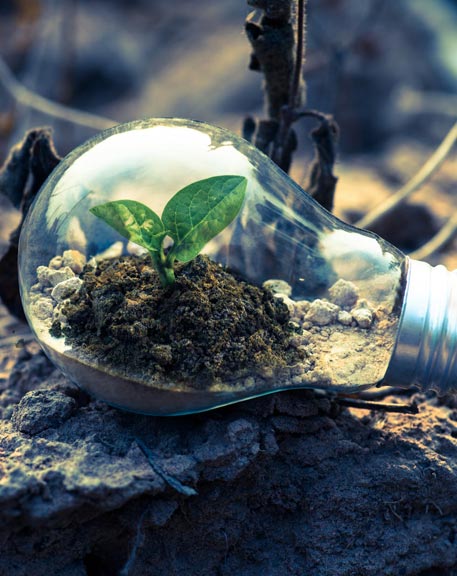
Locate an element on the screen. Image resolution: width=457 pixels, height=576 pixels. lightbulb is located at coordinates (136, 162).